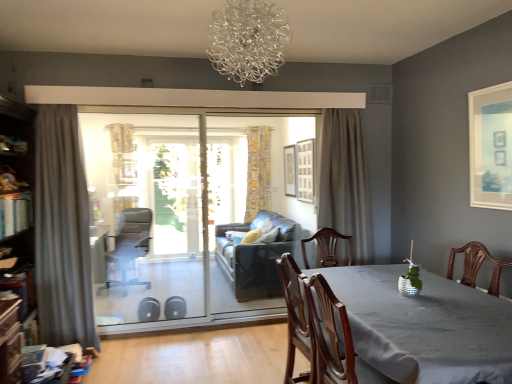
Question: In terms of height, does transparent glass screen door at center look taller or shorter compared to matte white picture frame at upper right, arranged as the 3th picture frame when viewed from the left?

Choices:
 (A) tall
 (B) short

Answer: (A)

Question: Looking at the image, does transparent glass screen door at center seem bigger or smaller compared to matte white picture frame at upper right, the first picture frame positioned from the right?

Choices:
 (A) big
 (B) small

Answer: (A)

Question: Which is farther from the wooden bookshelf at left?

Choices:
 (A) transparent glass door at center
 (B) yellow floral fabric curtain at center, the second curtain in the right-to-left sequence
 (C) gray textured curtain at center, placed as the second curtain when sorted from back to front
 (D) wooden picture frame at center, marked as the 2th picture frame in a right-to-left arrangement
 (E) leather swivel chair at left

Answer: (D)

Question: Which object is the farthest from the wooden bookshelf at left?

Choices:
 (A) smooth gray table at center
 (B) clear glass chandelier at upper center
 (C) transparent glass door at center
 (D) gray fabric curtain at left, positioned as the first curtain in left-to-right order
 (E) leather swivel chair at left

Answer: (A)